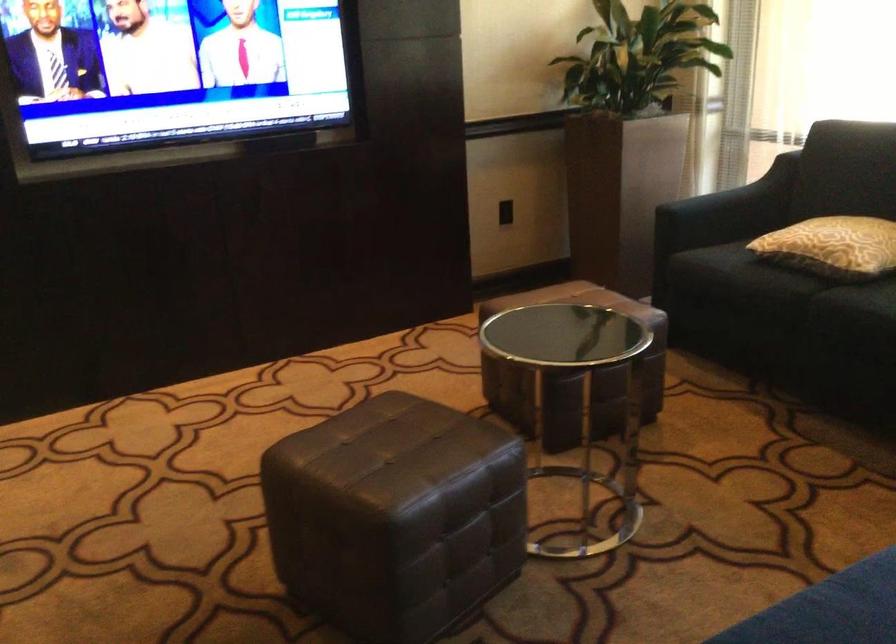
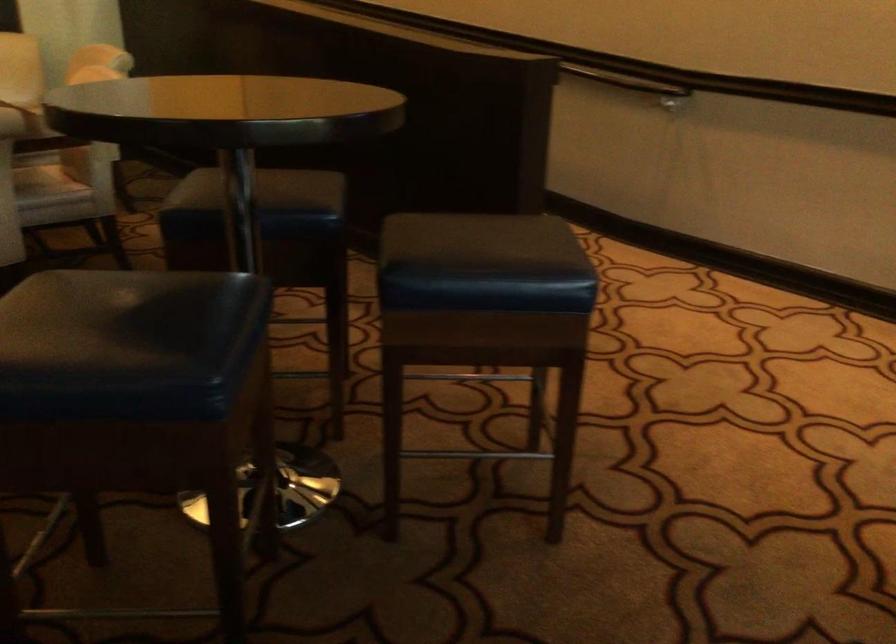
Based on the continuous images, in which direction is the camera rotating?

The rotation direction of the camera is left-down.